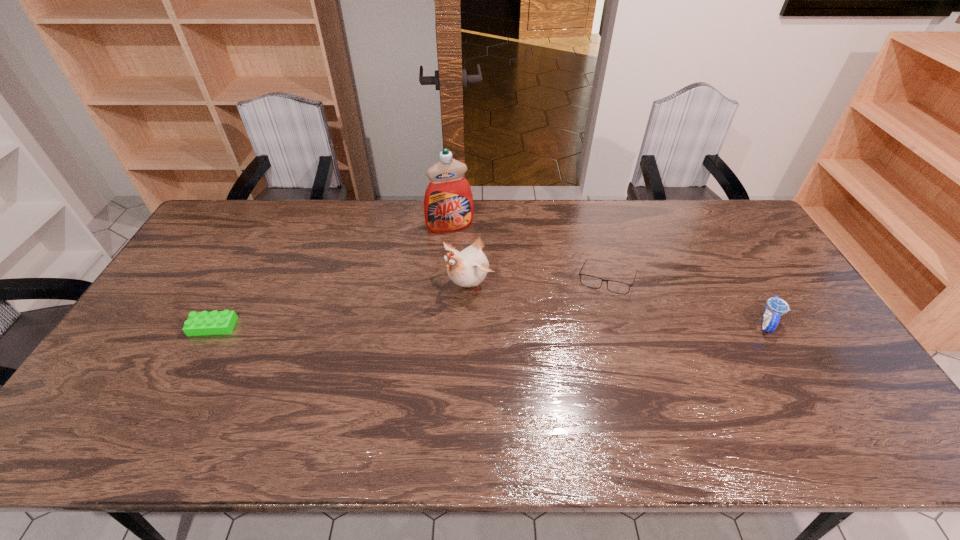
You are a GUI agent. You are given a task and a screenshot of the screen. Output one action in this format:
    pyautogui.click(x=<x>, y=<y>)
    Task: Click on the object that is at the far edge
    This screenshot has width=960, height=540.
    Given the screenshot: What is the action you would take?
    pyautogui.click(x=448, y=203)

Find the location of a particular element. The width and height of the screenshot is (960, 540). object at the left edge is located at coordinates (216, 322).

What are the coordinates of `object positioned at the right edge` in the screenshot? It's located at (776, 307).

At what (x,y) coordinates should I click in order to perform the action: click on vacant space at the far edge. Please return your answer as a coordinate pair (x, y). Looking at the image, I should click on (649, 200).

Find the location of a particular element. The width and height of the screenshot is (960, 540). vacant area at the near edge is located at coordinates (786, 407).

In the image, there is a desktop. Where is `vacant space at the right edge`? Image resolution: width=960 pixels, height=540 pixels. vacant space at the right edge is located at coordinates (752, 294).

Locate an element on the screen. The height and width of the screenshot is (540, 960). blank space at the far left corner of the desktop is located at coordinates (222, 229).

Locate an element on the screen. The image size is (960, 540). free location at the near left corner is located at coordinates (101, 396).

In the image, there is a desktop. What are the coordinates of `free region at the near right corner` in the screenshot? It's located at (846, 399).

I want to click on empty space that is in between the fourth shortest object and the rightmost object, so click(x=618, y=303).